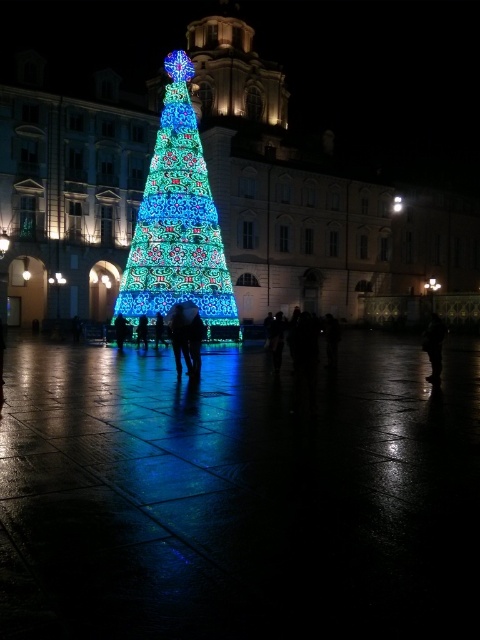
You are standing in front of the Christmas tree at the square. You want to take a photo of the grand building with classical columns and arches in the background. The camera you have can focus on objects up to 50 meters away. Is the point at coordinates point (x=170, y=317) in the image within the camera focus range?

The distance of point (x=170, y=317) from viewer is 55.69 meters, which is beyond the camera focus range of 50 meters. Therefore, the point at coordinates point (x=170, y=317) will not be in focus.

You are standing at the center of the square and want to take a photo of the smooth black figure at center. Where should you point your camera to capture it?

You should point your camera at point coordinates of (179, 337) to capture the smooth black figure at center.